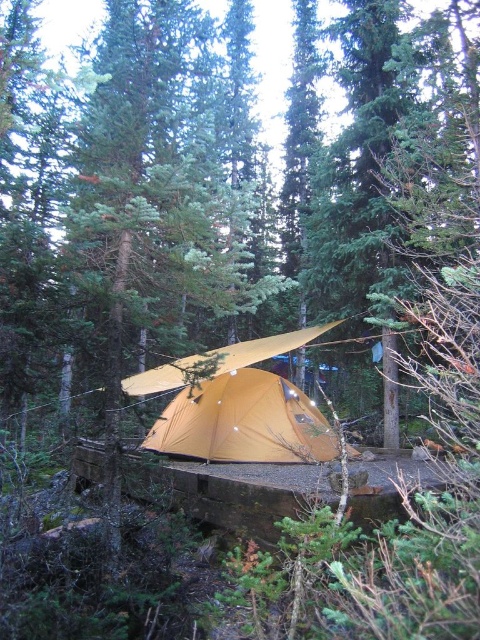
You are setting up a campsite and need to ensure that the matte yellow tent at center can fit underneath the matte yellow tarp at center. Based on the scene description, is there enough space for the tent to be fully covered by the tarp?

The matte yellow tent at center might be wider than matte yellow tarp at center, so there may not be enough space for the tent to be fully covered by the tarp.

From the picture: You are a camper who wants to set up a rain shelter over your tent. You have a matte yellow tent at center and a matte yellow tarp at center. Based on the scene, is the tarp already providing coverage over your tent?

Yes, the matte yellow tent at center is positioned under the matte yellow tarp at center, so the tarp is already providing coverage over the tent.

You are a camper who wants to know which object is taller between the matte yellow tent at center and the matte yellow tarp at center. Can you tell me which one is taller?

The matte yellow tent at center is taller than the matte yellow tarp at center.